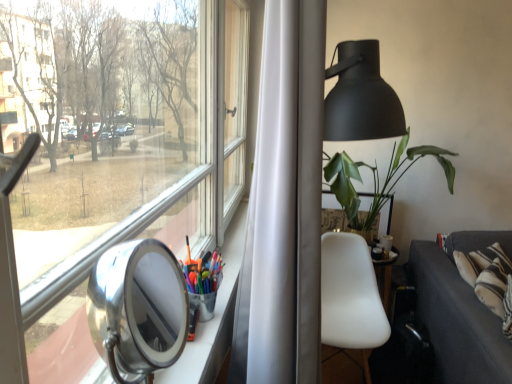
Question: Is polished silver view mirror at lower left in contact with green matte plant at right?

Choices:
 (A) no
 (B) yes

Answer: (A)

Question: Can you confirm if polished silver view mirror at lower left is taller than green matte plant at right?

Choices:
 (A) no
 (B) yes

Answer: (A)

Question: Is polished silver view mirror at lower left located outside green matte plant at right?

Choices:
 (A) no
 (B) yes

Answer: (B)

Question: From a real-world perspective, is polished silver view mirror at lower left below green matte plant at right?

Choices:
 (A) yes
 (B) no

Answer: (B)

Question: Would you consider polished silver view mirror at lower left to be distant from green matte plant at right?

Choices:
 (A) no
 (B) yes

Answer: (B)

Question: From the image's perspective, is polished silver view mirror at lower left on green matte plant at right?

Choices:
 (A) yes
 (B) no

Answer: (B)

Question: From the image's perspective, is white matte chair at center-right on green matte plant at right?

Choices:
 (A) no
 (B) yes

Answer: (A)

Question: Considering the relative sizes of white matte chair at center-right and green matte plant at right in the image provided, is white matte chair at center-right taller than green matte plant at right?

Choices:
 (A) no
 (B) yes

Answer: (B)

Question: From a real-world perspective, is white matte chair at center-right physically above green matte plant at right?

Choices:
 (A) yes
 (B) no

Answer: (B)

Question: Can you confirm if white matte chair at center-right is shorter than green matte plant at right?

Choices:
 (A) no
 (B) yes

Answer: (A)

Question: Is white matte chair at center-right further to camera compared to green matte plant at right?

Choices:
 (A) no
 (B) yes

Answer: (A)

Question: Can you confirm if white matte chair at center-right is positioned to the right of green matte plant at right?

Choices:
 (A) no
 (B) yes

Answer: (A)

Question: From the image's perspective, would you say polished silver view mirror at lower left is positioned over dark gray fabric couch at lower right?

Choices:
 (A) yes
 (B) no

Answer: (A)